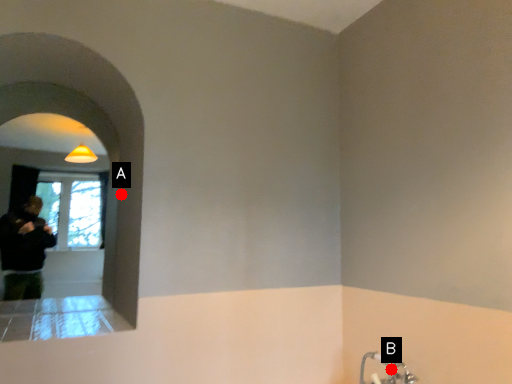
Question: Two points are circled on the image, labeled by A and B beside each circle. Which point is closer to the camera?

Choices:
 (A) A is closer
 (B) B is closer

Answer: (B)